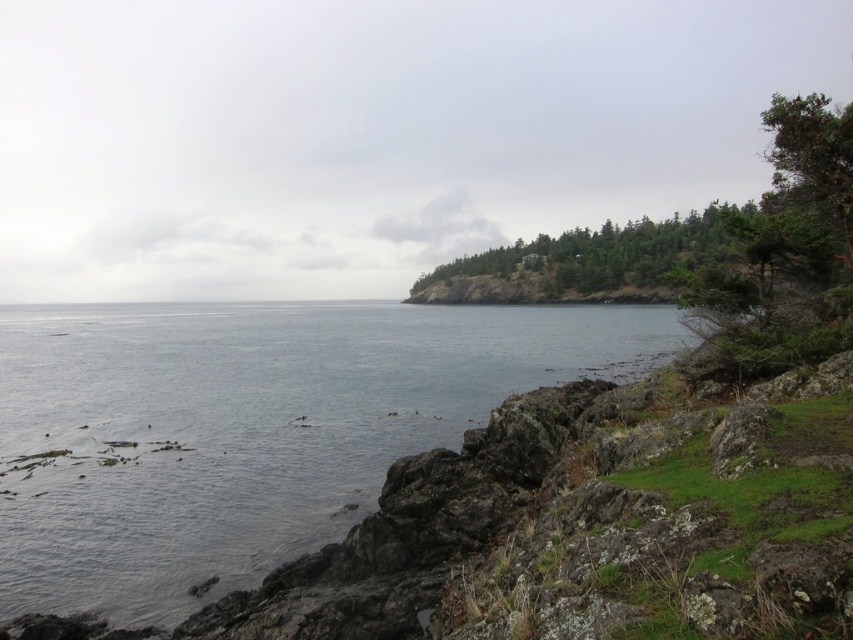
You are an ornithologist observing the coastal landscape. You notice the green textured tree at upper right and the green leafy trees at upper right. Which of these two objects is positioned lower in the image?

The green textured tree at upper right is located below the green leafy trees at upper right, so it is positioned lower in the image.

You are standing at the center of the image and want to reach the clear water at lower left. Which direction should you move to get there?

To reach the clear water at lower left, you should move towards the lower left direction from your current position at the center of the image.